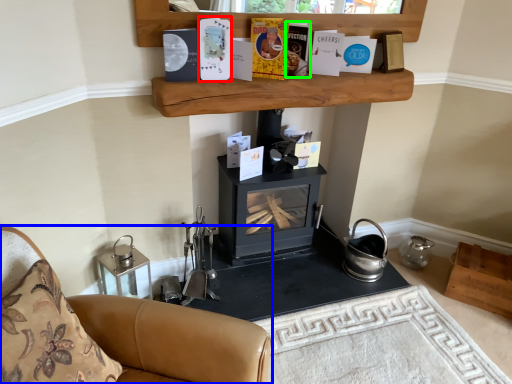
Question: Which is farther away from paperback book (highlighted by a red box)? furniture (highlighted by a blue box) or paperback book (highlighted by a green box)?

Choices:
 (A) furniture
 (B) paperback book

Answer: (A)